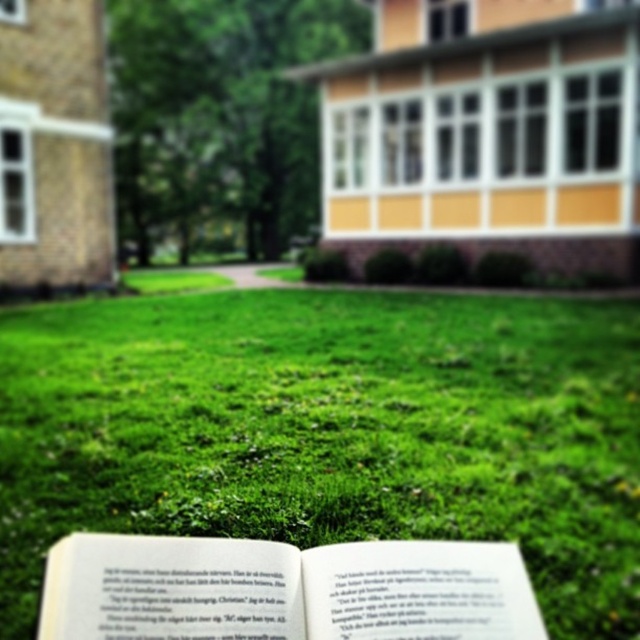
Question: Among these objects, which one is nearest to the camera?

Choices:
 (A) green grass at center
 (B) white paper book at center

Answer: (B)

Question: Which point is closer to the camera?

Choices:
 (A) (54, 563)
 (B) (282, 301)

Answer: (A)

Question: Is green grass at center closer to camera compared to white paper book at center?

Choices:
 (A) no
 (B) yes

Answer: (A)

Question: Is green grass at center to the left of white paper book at center from the viewer's perspective?

Choices:
 (A) no
 (B) yes

Answer: (A)

Question: From the image, what is the correct spatial relationship of green grass at center in relation to white paper book at center?

Choices:
 (A) right
 (B) left

Answer: (A)